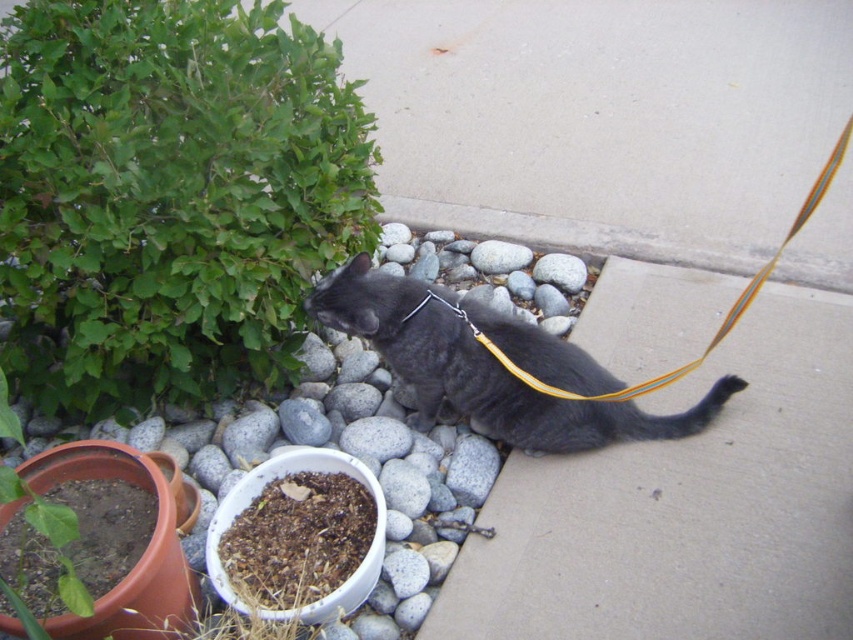
Question: Which point appears closest to the camera in this image?

Choices:
 (A) (312, 234)
 (B) (357, 304)
 (C) (579, 596)

Answer: (C)

Question: Which of the following is the closest to the observer?

Choices:
 (A) brown soil at lower left
 (B) gray concrete pavement at lower right
 (C) shiny black cat at center

Answer: (A)

Question: Estimate the real-world distances between objects in this image. Which object is closer to the brown soil at lower left?

Choices:
 (A) gray concrete pavement at lower right
 (B) shiny black cat at center
 (C) green leafy bush at upper left

Answer: (B)

Question: Is gray concrete pavement at lower right bigger than brown soil at lower left?

Choices:
 (A) no
 (B) yes

Answer: (B)

Question: Is shiny black cat at center to the left of brown soil at lower left from the viewer's perspective?

Choices:
 (A) yes
 (B) no

Answer: (B)

Question: Can you confirm if shiny black cat at center is bigger than brown soil at lower left?

Choices:
 (A) no
 (B) yes

Answer: (B)